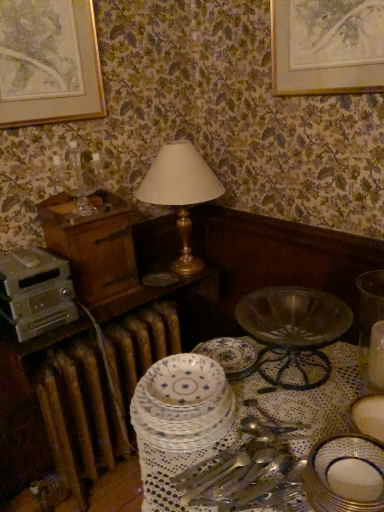
Question: Which direction should I rotate to look at porcelain plate at center, the 1th plate positioned from the left?

Choices:
 (A) right
 (B) left

Answer: (B)

Question: From a real-world perspective, is gold metallic table lamp at center below gold-framed artwork at upper left?

Choices:
 (A) no
 (B) yes

Answer: (B)

Question: Is gold metallic table lamp at center smaller than gold-framed artwork at upper left?

Choices:
 (A) no
 (B) yes

Answer: (A)

Question: Does gold metallic table lamp at center come behind gold-framed artwork at upper left?

Choices:
 (A) yes
 (B) no

Answer: (A)

Question: From a real-world perspective, is gold metallic table lamp at center positioned over gold-framed artwork at upper left based on gravity?

Choices:
 (A) yes
 (B) no

Answer: (B)

Question: Is gold-framed artwork at upper left at the back of gold metallic table lamp at center?

Choices:
 (A) no
 (B) yes

Answer: (A)

Question: From the image's perspective, is gold metallic table lamp at center under gold-framed artwork at upper left?

Choices:
 (A) no
 (B) yes

Answer: (B)

Question: From a real-world perspective, does gold metallic table lamp at center sit lower than porcelain plate at center, which appears as the 3th plate when viewed from the right?

Choices:
 (A) yes
 (B) no

Answer: (B)

Question: Does gold metallic table lamp at center have a larger size compared to porcelain plate at center, which is counted as the second plate, starting from the front?

Choices:
 (A) no
 (B) yes

Answer: (B)

Question: Considering the relative sizes of gold metallic table lamp at center and porcelain plate at center, arranged as the second plate when viewed from the back, in the image provided, is gold metallic table lamp at center taller than porcelain plate at center, arranged as the second plate when viewed from the back,?

Choices:
 (A) no
 (B) yes

Answer: (B)

Question: Would you say porcelain plate at center, the 1th plate positioned from the left, is part of gold metallic table lamp at center's contents?

Choices:
 (A) no
 (B) yes

Answer: (A)

Question: Could you tell me if gold metallic table lamp at center is turned towards porcelain plate at center, which is counted as the second plate, starting from the front?

Choices:
 (A) yes
 (B) no

Answer: (B)

Question: Considering the relative sizes of gold metallic table lamp at center and porcelain plate at center, which is counted as the second plate, starting from the front, in the image provided, is gold metallic table lamp at center smaller than porcelain plate at center, which is counted as the second plate, starting from the front,?

Choices:
 (A) yes
 (B) no

Answer: (B)

Question: Is porcelain plate at lower right, which is counted as the third plate, starting from the left, beside metallic silver appliance at left?

Choices:
 (A) no
 (B) yes

Answer: (A)